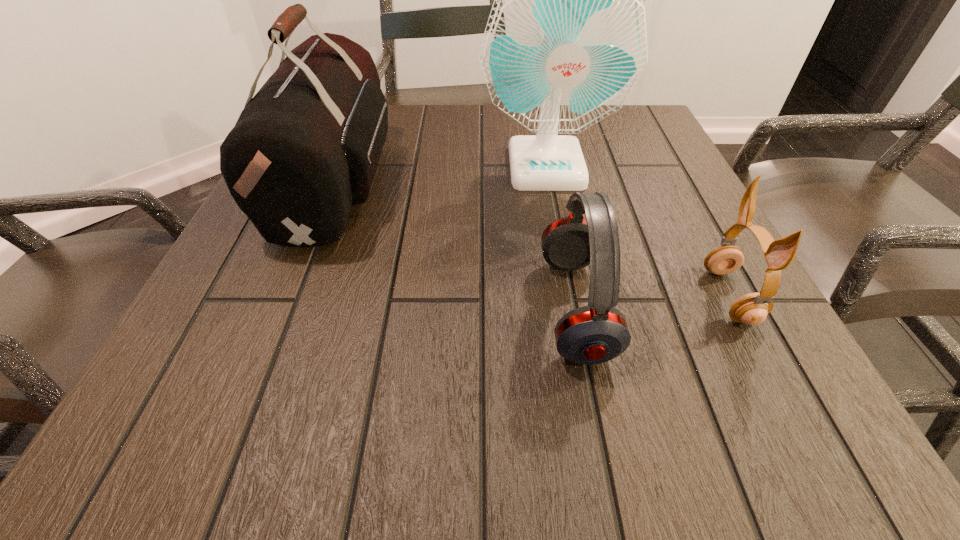
Locate an element on the screen. The height and width of the screenshot is (540, 960). free point between the fan and the right earphone is located at coordinates (637, 231).

Find the location of a particular element. Image resolution: width=960 pixels, height=540 pixels. vacant area that lies between the tallest object and the leftmost object is located at coordinates (442, 172).

Locate an element on the screen. The width and height of the screenshot is (960, 540). free spot between the fan and the rightmost object is located at coordinates (637, 231).

Identify the location of unoccupied position between the duffel bag and the right earphone. This screenshot has height=540, width=960. (533, 238).

Locate an element on the screen. object that stands as the third closest to the tallest object is located at coordinates (752, 309).

Locate an element on the screen. object that ranks as the third closest to the left earphone is located at coordinates (305, 148).